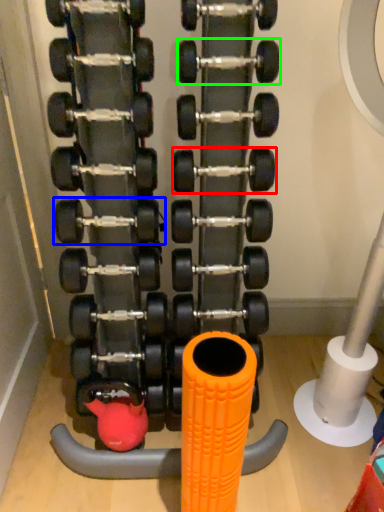
Question: Which is farther away from dumbbell (highlighted by a red box)? dumbbell (highlighted by a blue box) or dumbbell (highlighted by a green box)?

Choices:
 (A) dumbbell
 (B) dumbbell

Answer: (A)